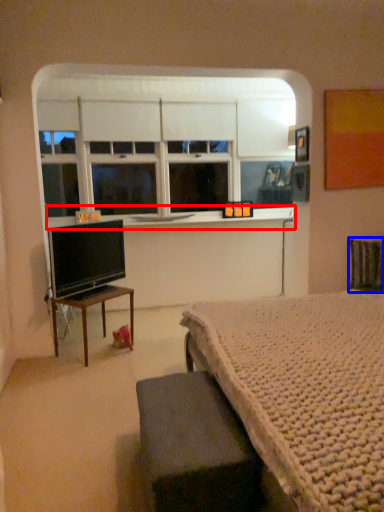
Question: Among these objects, which one is nearest to the camera, window sill (highlighted by a red box) or swivel chair (highlighted by a blue box)?

Choices:
 (A) window sill
 (B) swivel chair

Answer: (B)